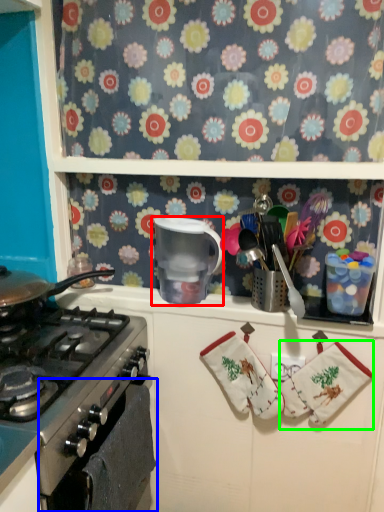
Question: Which object is the farthest from appliance (highlighted by a red box)? Choose among these: oven (highlighted by a blue box) or material (highlighted by a green box).

Choices:
 (A) oven
 (B) material

Answer: (B)